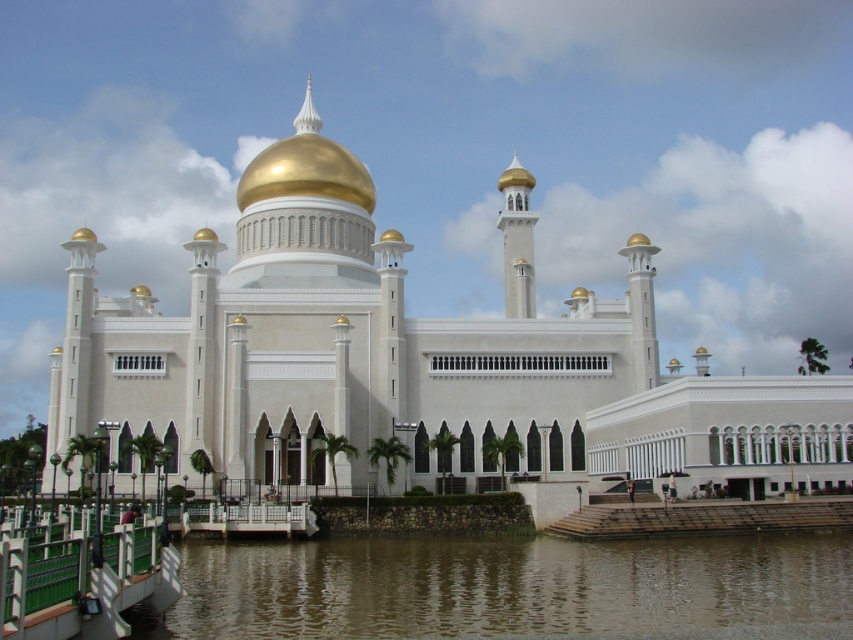
You are standing at the point marked by the coordinates point (x=415, y=362) in the image. What structure are you directly facing?

The point (x=415, y=362) indicates the white marble mosque at center, so you are directly facing the white marble mosque at center.

You are a tourist standing on the walkway with green railings in front of the mosque. You want to take a photo of the white marble mosque at center while standing on the brown murky water at lower center. Is this possible given their distance apart?

The white marble mosque at center and brown murky water at lower center are 22.13 meters apart from each other. Since you can stand on the brown murky water at lower center and the distance allows for a clear view, it is possible to take a photo of the white marble mosque at center from there.

You are standing in front of the grand mosque and want to take a photo. You notice two points marked in the scene. Which point is closer to you, point (x=78, y=275) or point (x=621, y=628)?

Point (x=78, y=275) is closer to you than point (x=621, y=628) because it is further to the viewer.